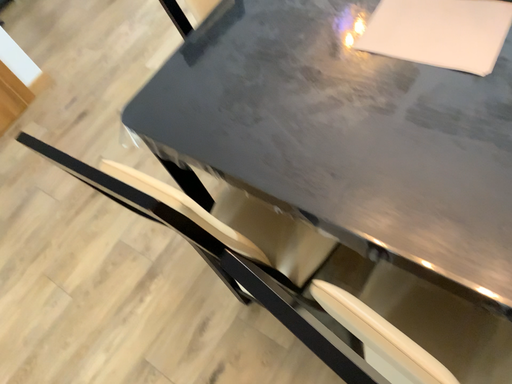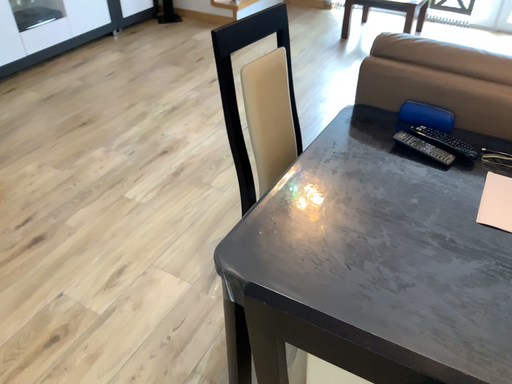
Question: Which way did the camera rotate in the video?

Choices:
 (A) rotated downward
 (B) rotated upward

Answer: (B)